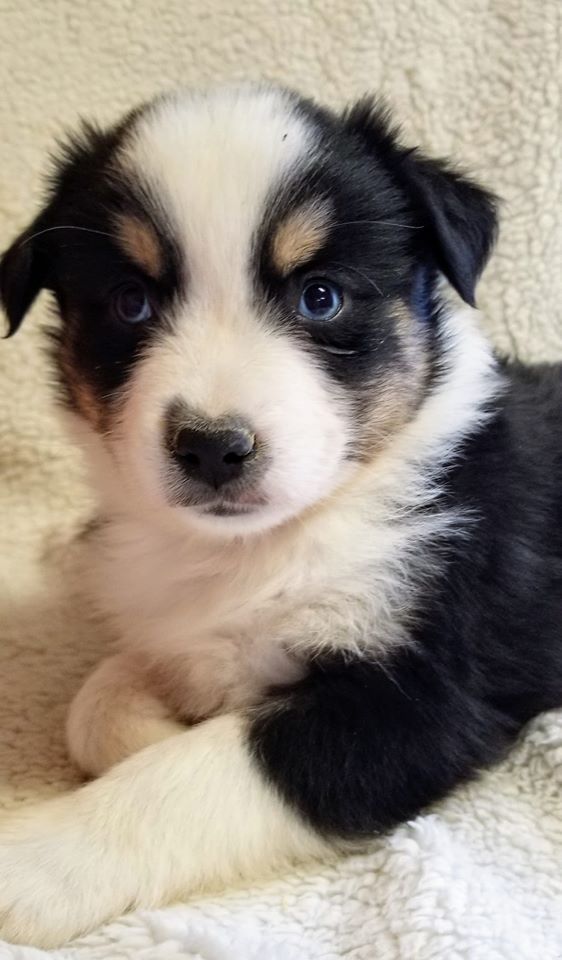
You are a GUI agent. You are given a task and a screenshot of the screen. Output one action in this format:
    pyautogui.click(x=<x>, y=<y>)
    Task: Click on the chest
    Image resolution: width=562 pixels, height=960 pixels.
    Given the screenshot: What is the action you would take?
    pyautogui.click(x=214, y=616)